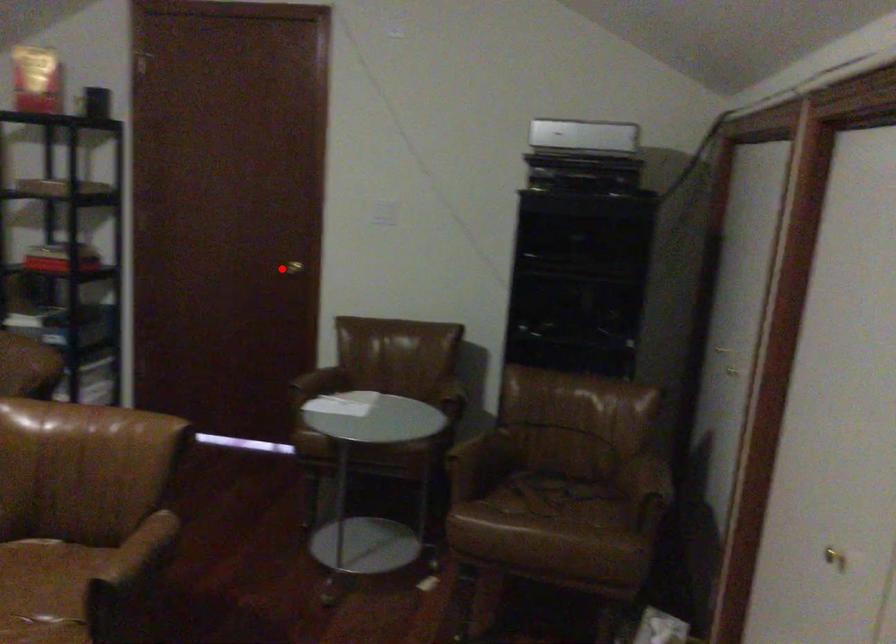
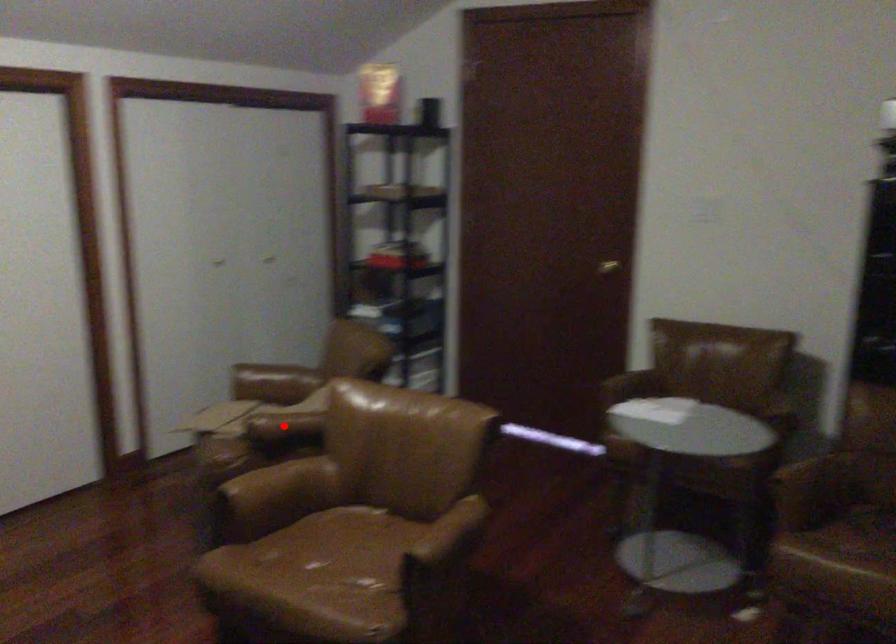
I am providing you with two images of the same scene from different viewpoints. A red point is marked on the first image and another point is marked on the second image. Is the marked point in image1 the same physical position as the marked point in image2?

No